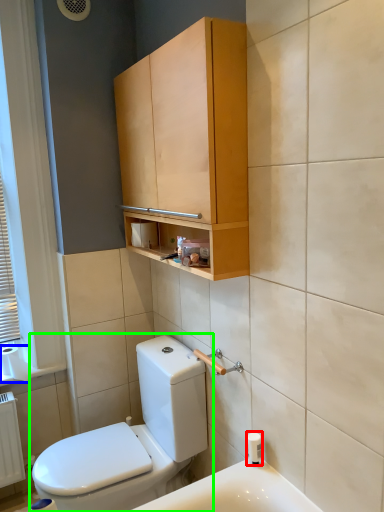
Question: Which object is positioned closest to toiletry (highlighted by a red box)? Select from to paper (highlighted by a blue box) and toilet (highlighted by a green box).

Choices:
 (A) to paper
 (B) toilet

Answer: (B)